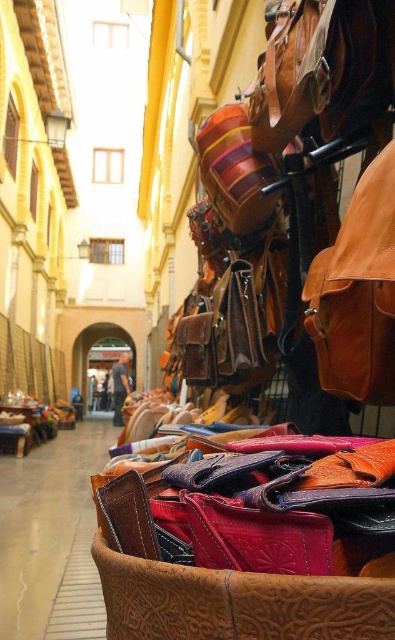
Question: Does brown leather wallet at center have a greater width compared to matte brown leather store at center?

Choices:
 (A) no
 (B) yes

Answer: (B)

Question: Is brown leather wallet at center to the right of matte brown leather store at center from the viewer's perspective?

Choices:
 (A) no
 (B) yes

Answer: (B)

Question: Among these points, which one is farthest from the camera?

Choices:
 (A) (92, 408)
 (B) (33, 611)

Answer: (A)

Question: Can you confirm if brown leather wallet at center is wider than matte brown leather store at center?

Choices:
 (A) yes
 (B) no

Answer: (A)